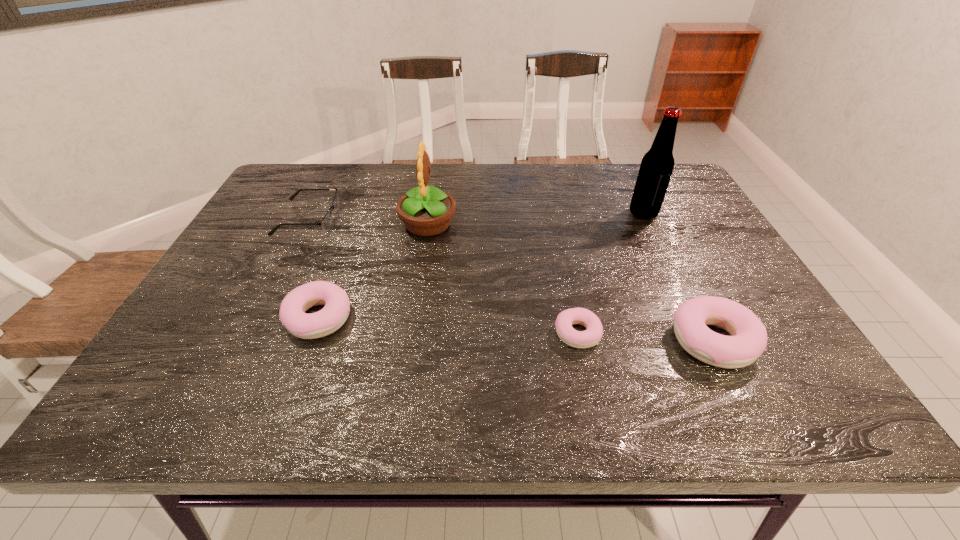
Where is `object that is at the near right corner`? This screenshot has height=540, width=960. object that is at the near right corner is located at coordinates (748, 340).

In the image, there is a desktop. At what (x,y) coordinates should I click in order to perform the action: click on vacant space at the far edge. Please return your answer as a coordinate pair (x, y). This screenshot has height=540, width=960. Looking at the image, I should click on (434, 167).

Find the location of a particular element. This screenshot has width=960, height=540. vacant point at the near edge is located at coordinates (650, 343).

In the image, there is a desktop. Where is `vacant space at the left edge`? vacant space at the left edge is located at coordinates (x=266, y=260).

Find the location of a particular element. free spot at the right edge of the desktop is located at coordinates (699, 243).

Locate an element on the screen. This screenshot has height=540, width=960. vacant space at the far left corner of the desktop is located at coordinates (317, 174).

In the image, there is a desktop. At what (x,y) coordinates should I click in order to perform the action: click on free region at the near left corner. Please return your answer as a coordinate pair (x, y). This screenshot has width=960, height=540. Looking at the image, I should click on (231, 356).

Locate an element on the screen. This screenshot has width=960, height=540. free area in between the tallest object and the second shortest object is located at coordinates (475, 215).

Where is `free space between the leftmost pastry and the second shortest object`? free space between the leftmost pastry and the second shortest object is located at coordinates (313, 268).

Find the location of a particular element. The width and height of the screenshot is (960, 540). free space between the rightmost pastry and the second shortest object is located at coordinates click(x=511, y=279).